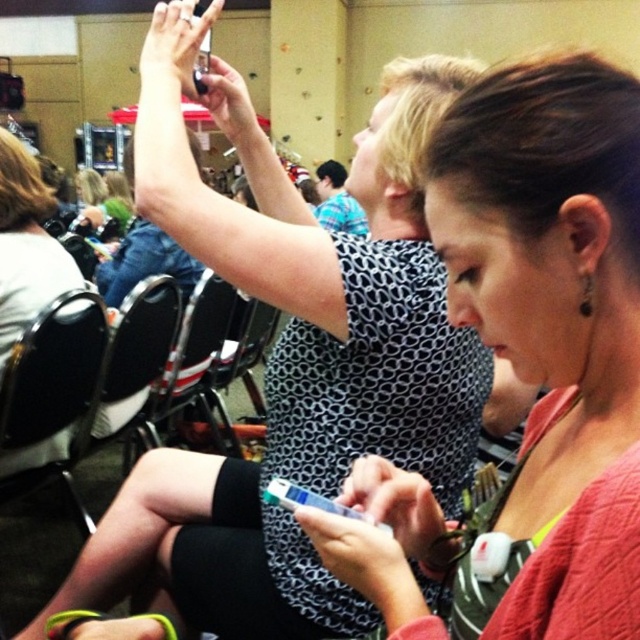
Who is more forward, (531, 128) or (8, 186)?

Point (531, 128) is more forward.

Based on the photo, does pink textured sweater at center appear on the left side of matte black chair at left?

In fact, pink textured sweater at center is to the right of matte black chair at left.

Is point (550, 104) positioned before point (22, 276)?

Yes, it is in front of point (22, 276).

I want to click on pink textured sweater at center, so click(x=547, y=269).

Is matte black chair at left to the left of black fabric chair at center from the viewer's perspective?

Correct, you'll find matte black chair at left to the left of black fabric chair at center.

Does matte black chair at left lie behind black fabric chair at center?

That is False.

Who is more distant from viewer, (68, 442) or (195, 390)?

Positioned behind is point (195, 390).

Locate an element on the screen. Image resolution: width=640 pixels, height=640 pixels. matte black chair at left is located at coordinates (26, 244).

Which is behind, point (576, 148) or point (198, 284)?

Point (198, 284)

Is pink textured sweater at center thinner than black fabric chair at center?

Correct, pink textured sweater at center's width is less than black fabric chair at center's.

The width and height of the screenshot is (640, 640). What do you see at coordinates (547, 269) in the screenshot?
I see `pink textured sweater at center` at bounding box center [547, 269].

Image resolution: width=640 pixels, height=640 pixels. Identify the location of pink textured sweater at center. (547, 269).